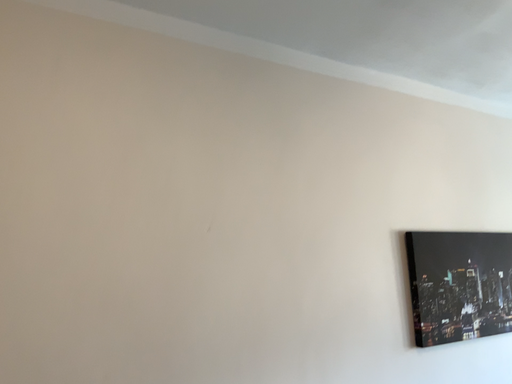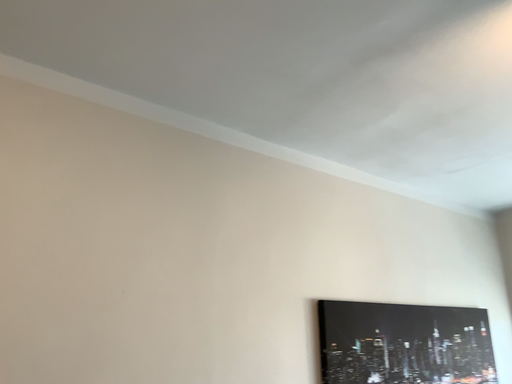
Question: Which way did the camera rotate in the video?

Choices:
 (A) rotated left
 (B) rotated right

Answer: (B)